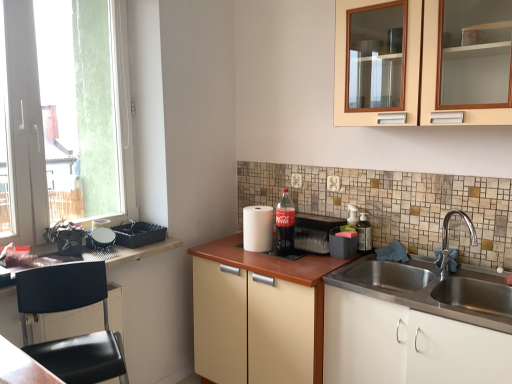
Find the location of `free space in front of matte plastic soda at center, acting as the third appliance starting from the left`. free space in front of matte plastic soda at center, acting as the third appliance starting from the left is located at coordinates (302, 264).